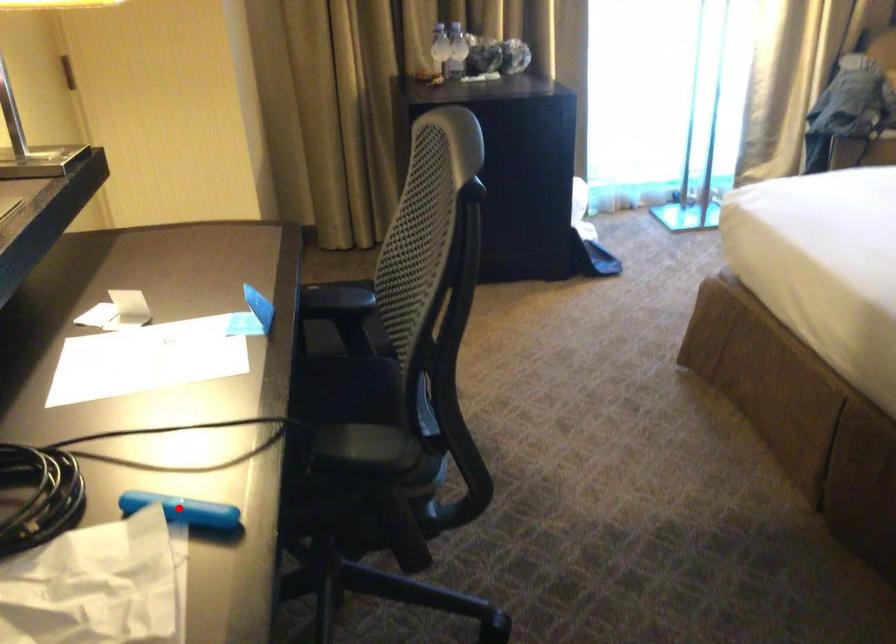
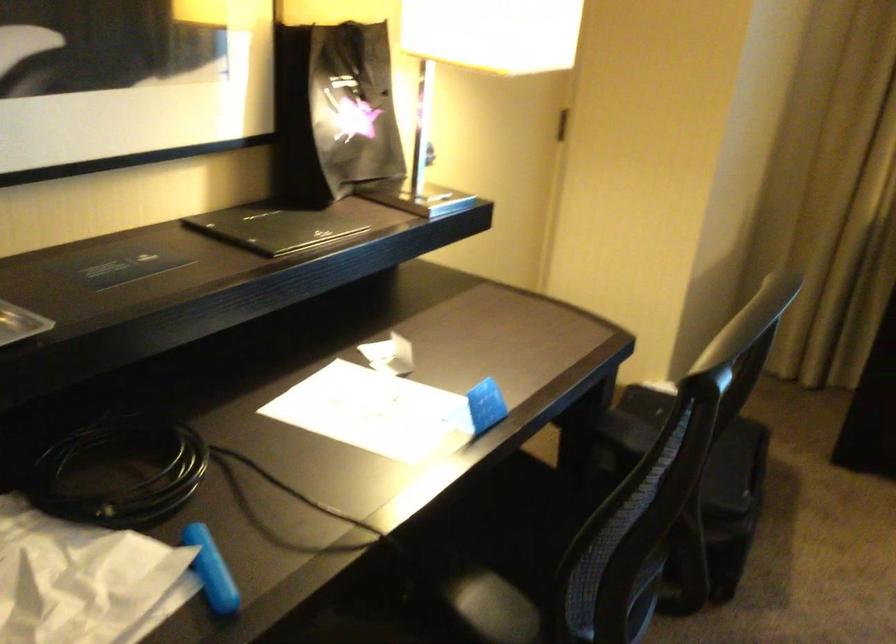
In the second image, find the point that corresponds to the highlighted location in the first image.

(211, 570)